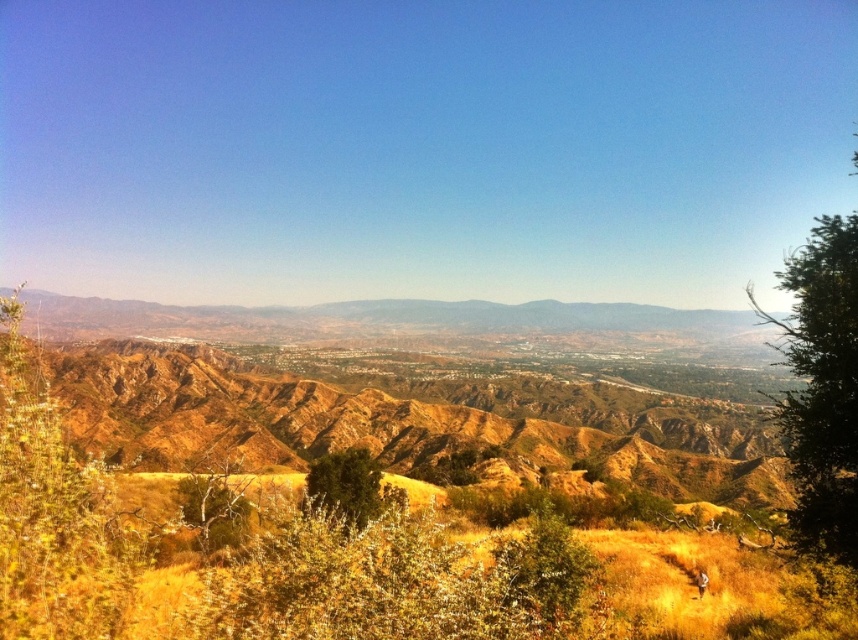
Describe the element at coordinates (820, 387) in the screenshot. I see `green leafy tree at right` at that location.

Is green leafy tree at right further to the viewer compared to brown textured tree at lower left?

No, it is not.

You are a GUI agent. You are given a task and a screenshot of the screen. Output one action in this format:
    pyautogui.click(x=<x>, y=<y>)
    Task: Click on the green leafy tree at right
    Image resolution: width=858 pixels, height=640 pixels.
    Given the screenshot: What is the action you would take?
    pyautogui.click(x=820, y=387)

Which is more to the right, green leafy shrub at lower left or green leafy tree at center?

green leafy tree at center is more to the right.

Who is more distant from viewer, (94, 557) or (563, 520)?

Point (563, 520)

Describe the element at coordinates (51, 513) in the screenshot. This screenshot has width=858, height=640. I see `green leafy shrub at lower left` at that location.

This screenshot has height=640, width=858. I want to click on green leafy shrub at lower left, so click(51, 513).

Does green leafy tree at center lie in front of green matte tree at center?

Yes, it is in front of green matte tree at center.

Is green leafy tree at center taller than green matte tree at center?

Incorrect, green leafy tree at center's height is not larger of green matte tree at center's.

Does point (573, 564) lie behind point (346, 516)?

Yes, it is behind point (346, 516).

Locate an element on the screen. green leafy tree at center is located at coordinates (544, 566).